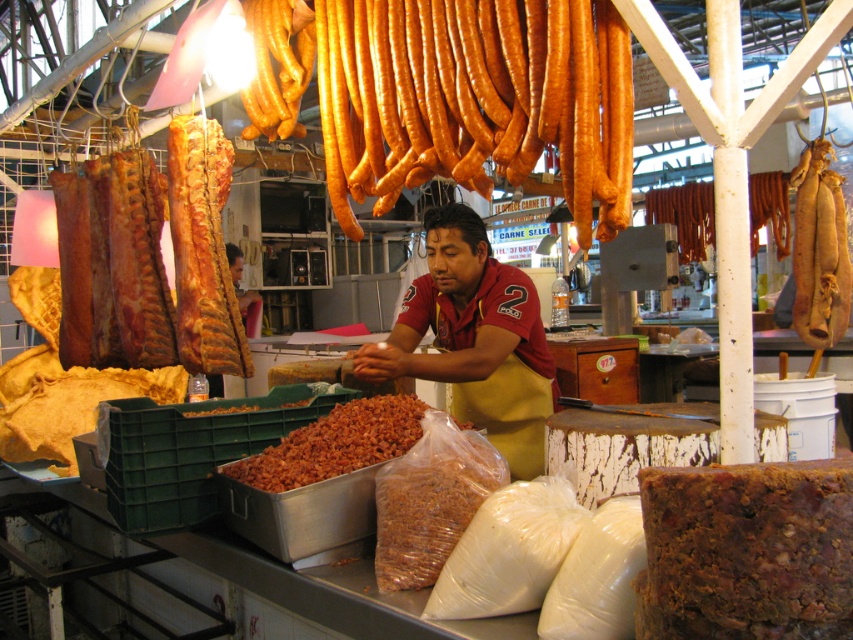
You are a customer at the meat market stall. You notice two items at the center of the stall. One is the brown apron at center and the other is the brown crumbly food at center. Which item is bigger in size?

A: The brown apron at center has a larger size compared to the brown crumbly food at center.

You are a customer at the meat market stall and want to buy both the brown matte dried beans at center and the brown crumbly food at center. Which item is located higher up on the stall?

The brown crumbly food at center is located higher up than the brown matte dried beans at center.

You are a customer at the meat market stall. You want to buy the shiny brown sausages at upper center and the brown crumbly snack at center. The store has a rule that if one item is larger than the other, you must buy the smaller one first. Which item should you purchase first?

The shiny brown sausages at upper center is larger in size than the brown crumbly snack at center, so you must buy the brown crumbly snack at center first.